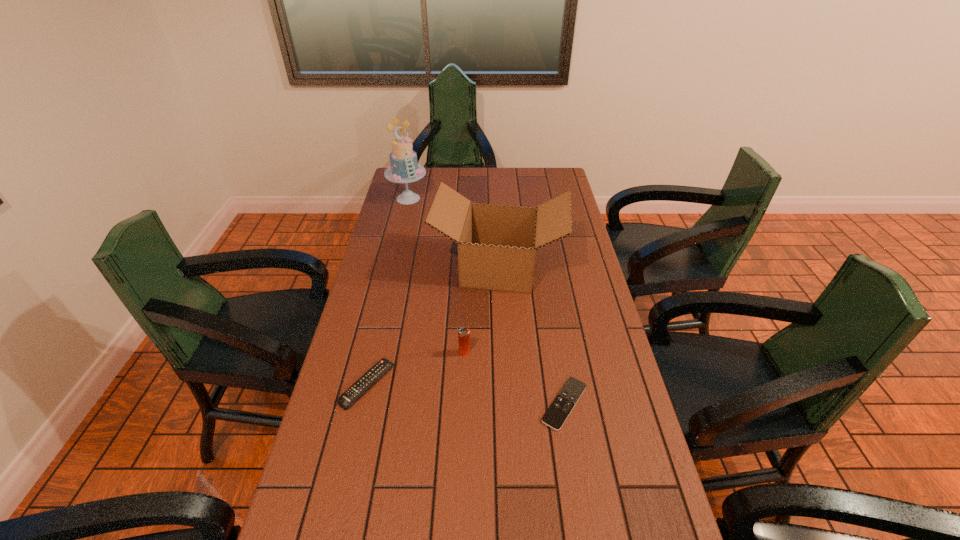
What are the coordinates of `vacant space that's between the third tallest object and the tallest object` in the screenshot? It's located at (437, 275).

Find the location of a particular element. The width and height of the screenshot is (960, 540). unoccupied position between the fourth shortest object and the left remote control is located at coordinates (433, 326).

What are the coordinates of `free space between the tallest object and the taller remote control` in the screenshot? It's located at (388, 292).

At what (x,y) coordinates should I click in order to perform the action: click on free area in between the taller remote control and the third farthest object. Please return your answer as a coordinate pair (x, y). The height and width of the screenshot is (540, 960). Looking at the image, I should click on (417, 368).

Where is `the second closest object to the cake`? This screenshot has width=960, height=540. the second closest object to the cake is located at coordinates (463, 334).

In order to click on object that is the closest one to the box in this screenshot , I will do `click(463, 334)`.

Where is `blank area in the image that satisfies the following two spatial constraints: 1. with a ladder on the side of the farthest object; 2. on the left side of the right remote control`? The width and height of the screenshot is (960, 540). blank area in the image that satisfies the following two spatial constraints: 1. with a ladder on the side of the farthest object; 2. on the left side of the right remote control is located at coordinates (360, 403).

This screenshot has height=540, width=960. In order to click on blank area in the image that satisfies the following two spatial constraints: 1. with a ladder on the side of the right remote control; 2. on the right side of the cake in this screenshot , I will do `click(360, 403)`.

Where is `vacant point that satisfies the following two spatial constraints: 1. with a ladder on the side of the farthest object; 2. on the left side of the igniter`? This screenshot has width=960, height=540. vacant point that satisfies the following two spatial constraints: 1. with a ladder on the side of the farthest object; 2. on the left side of the igniter is located at coordinates (372, 353).

You are a GUI agent. You are given a task and a screenshot of the screen. Output one action in this format:
    pyautogui.click(x=<x>, y=<y>)
    Task: Click on the vacant point that satisfies the following two spatial constraints: 1. with a ladder on the side of the shorter remote control; 2. on the left side of the cake
    
    Given the screenshot: What is the action you would take?
    pyautogui.click(x=360, y=403)